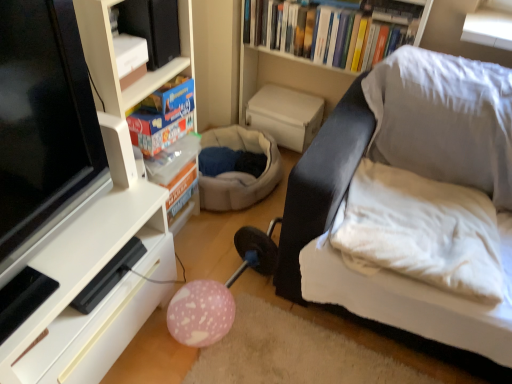
I want to click on free point below black glossy tv at left (from a real-world perspective), so click(x=61, y=254).